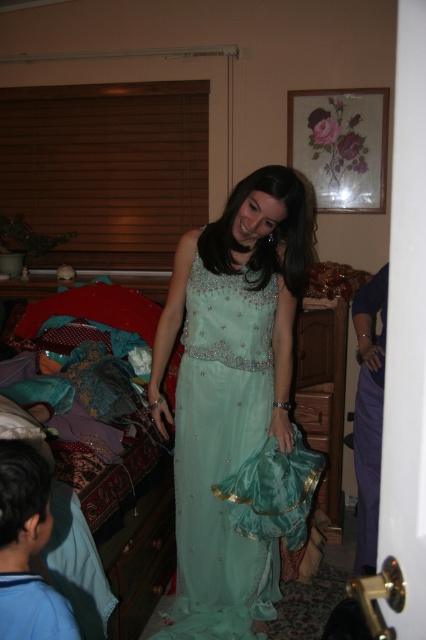
Can you confirm if satin teal dress at center is wider than teal satin gown at center?

Indeed, satin teal dress at center has a greater width compared to teal satin gown at center.

Is satin teal dress at center behind teal satin gown at center?

No, it is not.

Is point (275, 426) in front of point (354, 307)?

Yes, it is in front of point (354, 307).

At what (x,y) coordinates should I click in order to perform the action: click on satin teal dress at center. Please return your answer as a coordinate pair (x, y). Looking at the image, I should click on (236, 406).